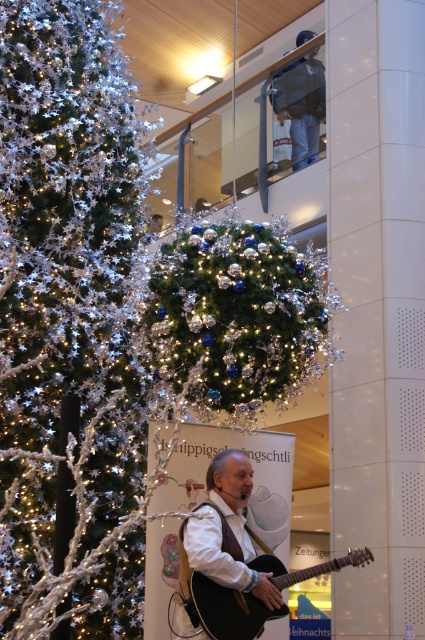
Question: Which of the following is the closest to the observer?

Choices:
 (A) white matte guitar at center
 (B) shiny silver ornaments at center
 (C) matte black guitar at center

Answer: (C)

Question: Which point is farther to the camera?

Choices:
 (A) shiny silver ornaments at center
 (B) denim jacket at upper center

Answer: (B)

Question: Considering the real-world distances, which object is farthest from the white matte guitar at center?

Choices:
 (A) denim jacket at upper center
 (B) shiny silver ornaments at center
 (C) matte black guitar at center

Answer: (A)

Question: Does white matte guitar at center appear under denim jacket at upper center?

Choices:
 (A) yes
 (B) no

Answer: (A)

Question: Is shiny silver ornaments at center wider than matte black guitar at center?

Choices:
 (A) yes
 (B) no

Answer: (A)

Question: Does shiny silver ornaments at center appear over matte black guitar at center?

Choices:
 (A) no
 (B) yes

Answer: (B)